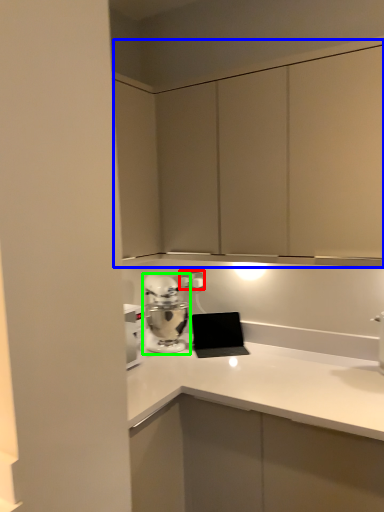
Question: Estimate the real-world distances between objects in this image. Which object is farther from electric outlet (highlighted by a red box), dresser (highlighted by a blue box) or home appliance (highlighted by a green box)?

Choices:
 (A) dresser
 (B) home appliance

Answer: (A)